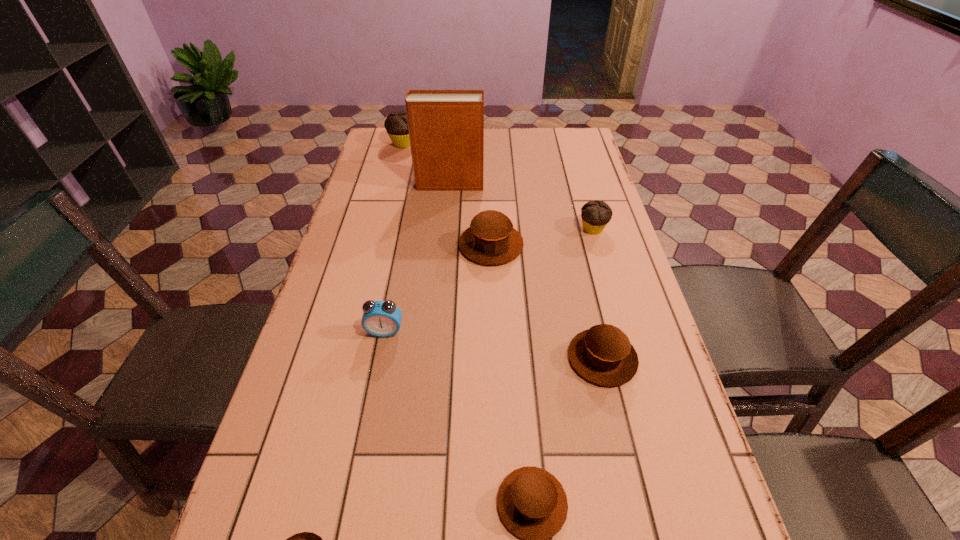
Find the location of a particular element. the second farthest object is located at coordinates (446, 127).

Image resolution: width=960 pixels, height=540 pixels. In order to click on the tallest object in this screenshot , I will do `click(446, 127)`.

Locate an element on the screen. the bigger chocolate muffin is located at coordinates (396, 125).

Where is `the farthest muffin`? the farthest muffin is located at coordinates (396, 125).

Where is `the biggest brown muffin`? the biggest brown muffin is located at coordinates (491, 239).

The width and height of the screenshot is (960, 540). Find the location of `alarm clock`. alarm clock is located at coordinates (380, 318).

The image size is (960, 540). In order to click on the second biggest brown muffin in this screenshot , I will do point(603,355).

Where is `the rightmost brown muffin`? The height and width of the screenshot is (540, 960). the rightmost brown muffin is located at coordinates (603, 355).

At what (x,y) coordinates should I click in order to perform the action: click on the nearer chocolate muffin. Please return your answer as a coordinate pair (x, y). The height and width of the screenshot is (540, 960). Looking at the image, I should click on (595, 215).

You are a GUI agent. You are given a task and a screenshot of the screen. Output one action in this format:
    pyautogui.click(x=<x>, y=<y>)
    Task: Click on the right chocolate muffin
    The width and height of the screenshot is (960, 540).
    Given the screenshot: What is the action you would take?
    pyautogui.click(x=595, y=215)